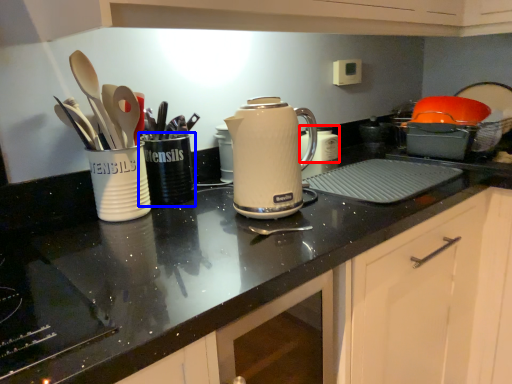
Question: Which object appears closest to the camera in this image, appliance (highlighted by a red box) or tableware (highlighted by a blue box)?

Choices:
 (A) appliance
 (B) tableware

Answer: (B)